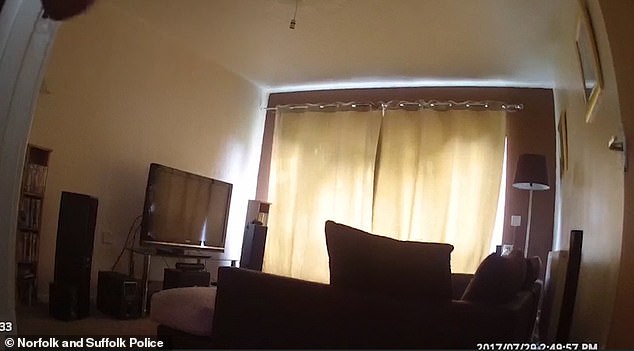
Locate an element on the screen. The height and width of the screenshot is (351, 634). brown wooden door is located at coordinates (588, 151).